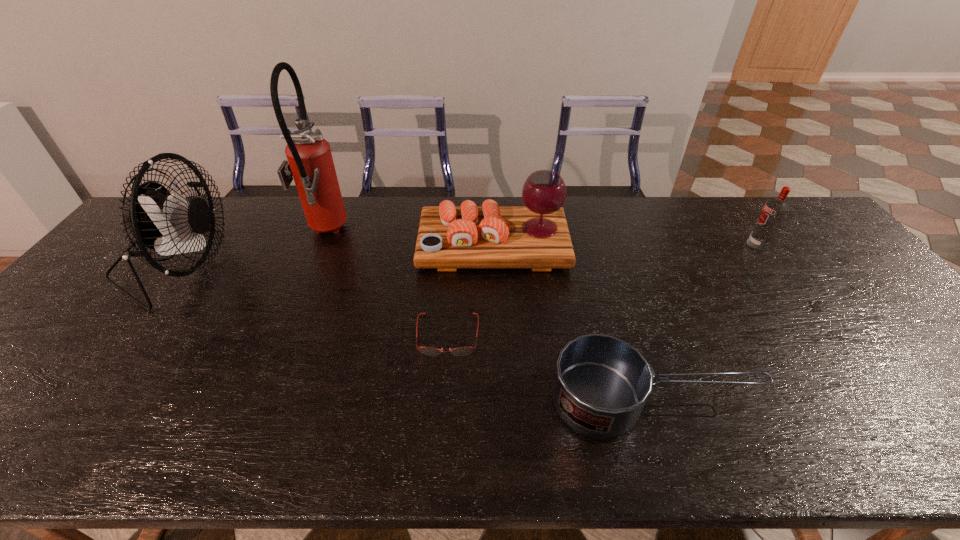
Locate an element on the screen. The width and height of the screenshot is (960, 540). vacant area that lies between the second object from left to right and the leftmost object is located at coordinates (251, 249).

Locate an element on the screen. The image size is (960, 540). free area in between the shortest object and the leftmost object is located at coordinates (312, 300).

Where is `vacant space that is in between the platter and the tallest object`? This screenshot has width=960, height=540. vacant space that is in between the platter and the tallest object is located at coordinates (409, 239).

In order to click on vacant area between the platter and the saucepan in this screenshot , I will do click(x=573, y=322).

Where is `vacant space that is in between the second shortest object and the spectacles`? vacant space that is in between the second shortest object and the spectacles is located at coordinates (550, 367).

I want to click on the third closest object relative to the second object from left to right, so click(x=460, y=351).

Locate which object ranks fourth in proximity to the platter. Please provide its 2D coordinates. Your answer should be formatted as a tuple, i.e. [(x, y)], where the tuple contains the x and y coordinates of a point satisfying the conditions above.

[(158, 220)]

In order to click on vacant space that satisfies the following two spatial constraints: 1. on the front label of the rightmost object; 2. on the lenses of the spectacles in this screenshot , I will do `click(824, 335)`.

You are a GUI agent. You are given a task and a screenshot of the screen. Output one action in this format:
    pyautogui.click(x=<x>, y=<y>)
    Task: Click on the free space that satisfies the following two spatial constraints: 1. on the front label of the vodka; 2. on the lenses of the shortest object
    The image size is (960, 540).
    Given the screenshot: What is the action you would take?
    pyautogui.click(x=824, y=335)